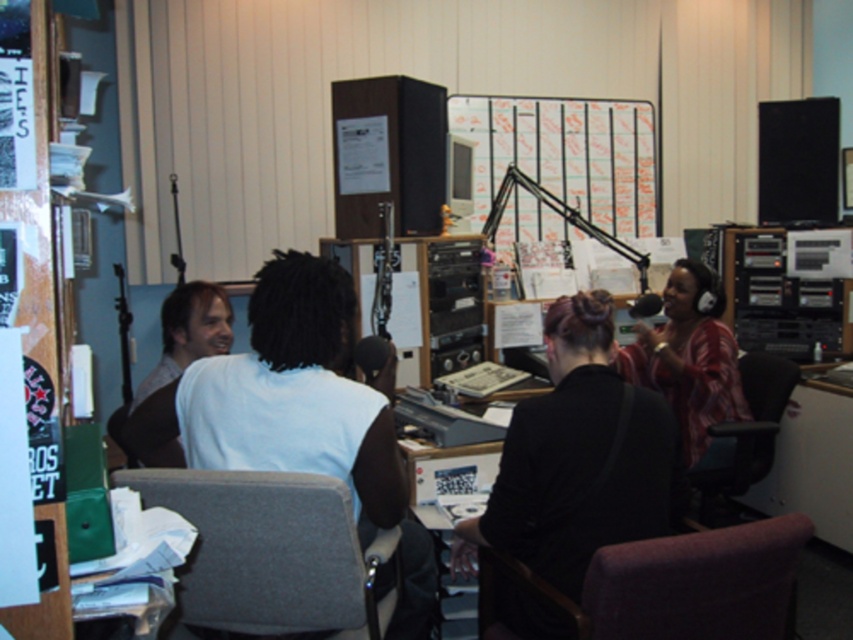
Question: In this image, where is plaid fabric shirt at right located relative to black leather chair at lower right?

Choices:
 (A) left
 (B) right

Answer: (A)

Question: Which point is closer to the camera taking this photo?

Choices:
 (A) (498, 586)
 (B) (787, 392)

Answer: (A)

Question: Which of the following is the farthest from the observer?

Choices:
 (A) plaid fabric shirt at right
 (B) black leather chair at lower right

Answer: (A)

Question: Based on their relative distances, which object is nearer to the purple fabric swivel chair at lower right?

Choices:
 (A) gray fabric swivel chair at center
 (B) plaid fabric shirt at right

Answer: (A)

Question: Is purple fabric swivel chair at lower right smaller than plaid fabric shirt at right?

Choices:
 (A) no
 (B) yes

Answer: (B)

Question: Is black matte shirt at center to the left of gray fabric swivel chair at center from the viewer's perspective?

Choices:
 (A) yes
 (B) no

Answer: (B)